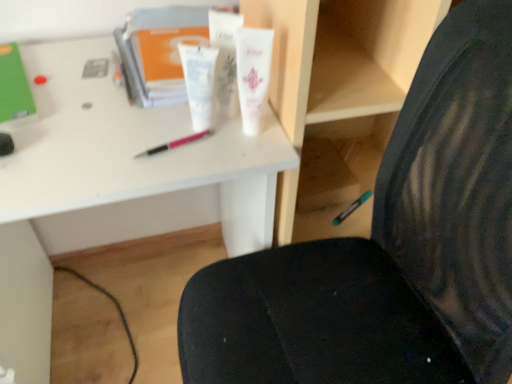
The height and width of the screenshot is (384, 512). Find the location of `free space between green matte folder at upper left, the second stationery from the back, and pink plastic pen at center`. free space between green matte folder at upper left, the second stationery from the back, and pink plastic pen at center is located at coordinates (84, 112).